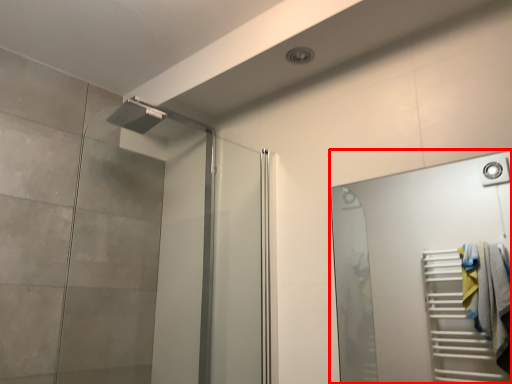
Question: In this image, where is door (annotated by the red box) located relative to screen door?

Choices:
 (A) right
 (B) left

Answer: (A)